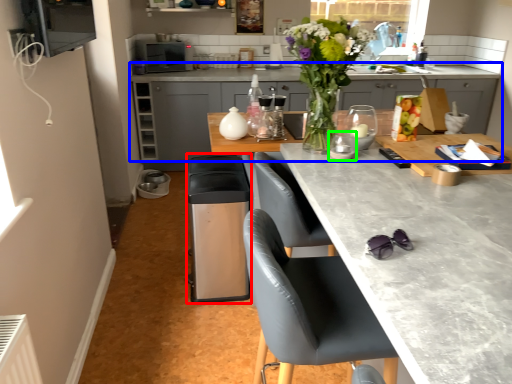
Question: Which object is the closest to the appliance (highlighted by a red box)? Choose among these: cabinetry (highlighted by a blue box) or appliance (highlighted by a green box).

Choices:
 (A) cabinetry
 (B) appliance

Answer: (B)